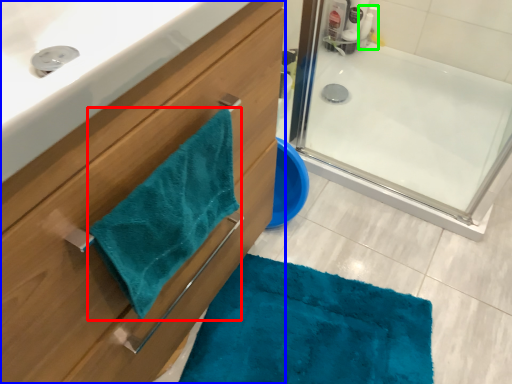
Question: Considering the real-world distances, which object is farthest from beach towel (highlighted by a red box)? bathroom cabinet (highlighted by a blue box) or cleaning product (highlighted by a green box)?

Choices:
 (A) bathroom cabinet
 (B) cleaning product

Answer: (B)